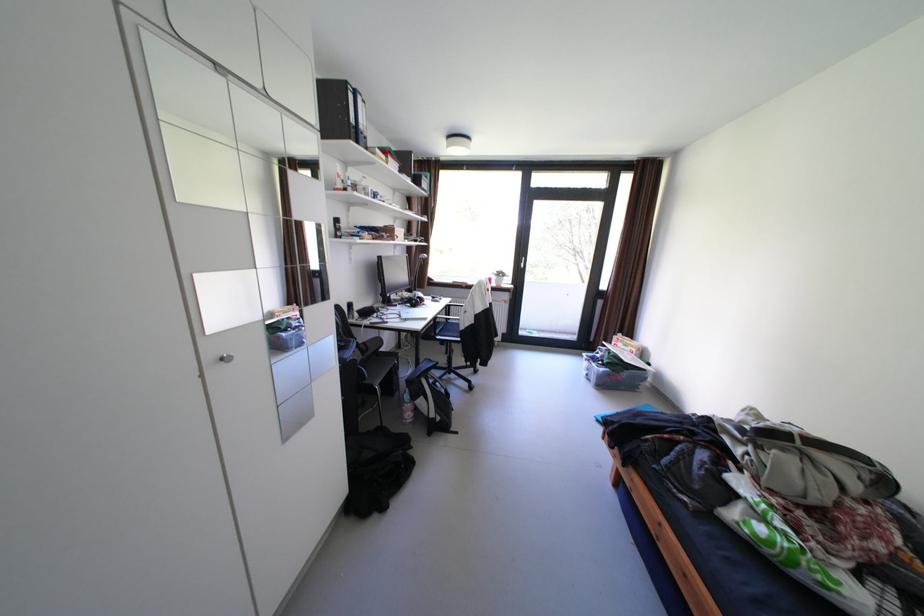
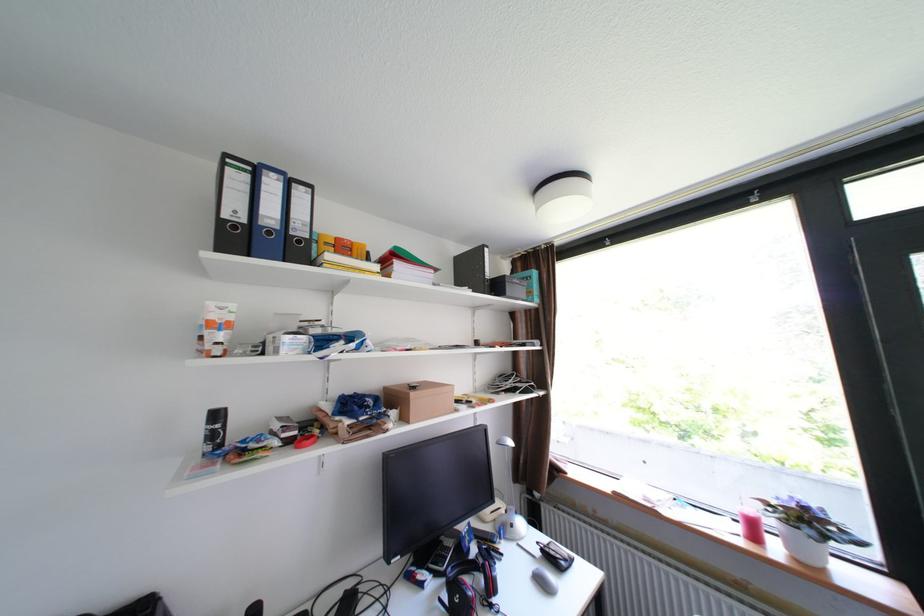
The point at (505, 278) is marked in the first image. Where is the corresponding point in the second image?

(782, 523)